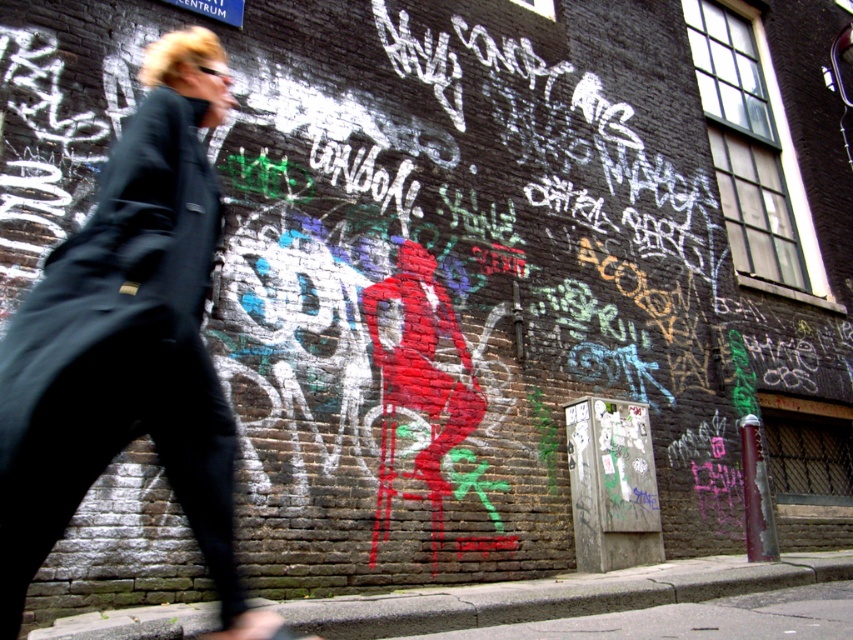
You are a delivery person trying to locate a matte black coat at left in an urban street scene with a textured brick wall covered in graffiti. The coordinates given are point (128, 340). Can you confirm if this point corresponds to the matte black coat at left?

Yes, the point (128, 340) corresponds to the matte black coat at left as stated in the objects description.

You are a delivery person trying to place a package on the concrete sidewalk at lower center. However, there is a matte black coat at left in the way. Can you move the coat to the side to make space?

The matte black coat at left is positioned on the left side of the concrete sidewalk at lower center. To move it, you would need to shift it further to the left, away from the sidewalk, to clear space for the package.